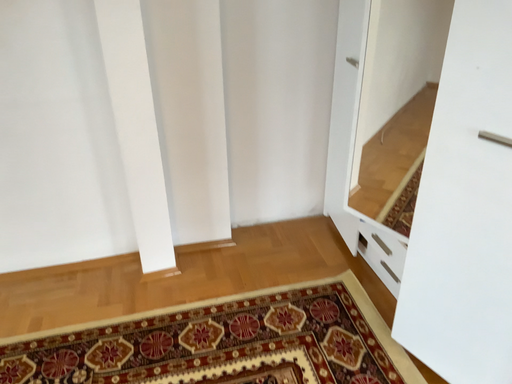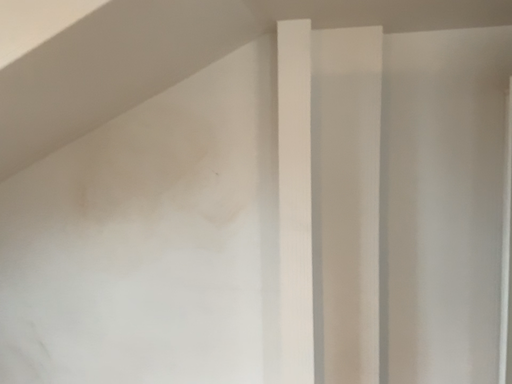
Question: Which way did the camera rotate in the video?

Choices:
 (A) rotated downward
 (B) rotated upward

Answer: (B)